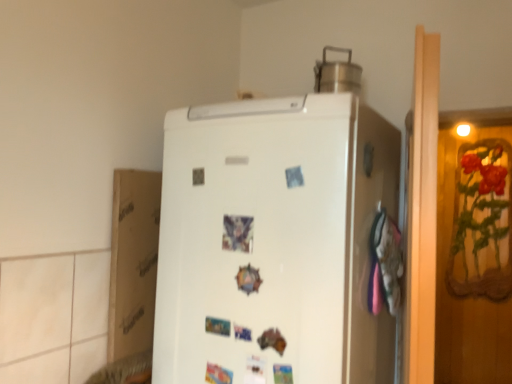
Question: From the image's perspective, is white matte refrigerator at center above or below brushed metal pot at upper center?

Choices:
 (A) above
 (B) below

Answer: (B)

Question: In terms of width, does white matte refrigerator at center look wider or thinner when compared to brushed metal pot at upper center?

Choices:
 (A) wide
 (B) thin

Answer: (A)

Question: Which of these objects is positioned closest to the white matte refrigerator at center?

Choices:
 (A) brushed metal pot at upper center
 (B) white cardboard at left

Answer: (B)

Question: Considering the real-world distances, which object is closest to the white cardboard at left?

Choices:
 (A) brushed metal pot at upper center
 (B) white matte refrigerator at center

Answer: (B)